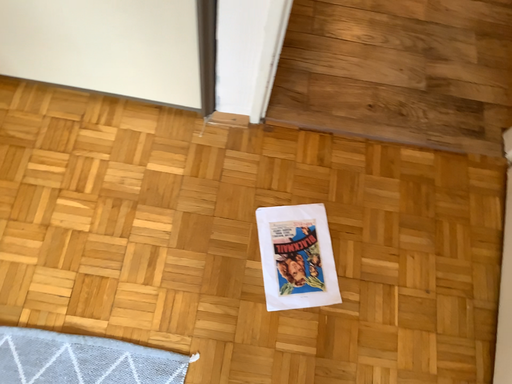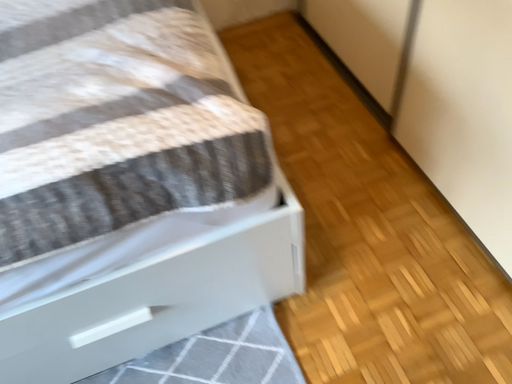
Question: Which way did the camera rotate in the video?

Choices:
 (A) rotated upward
 (B) rotated downward

Answer: (A)